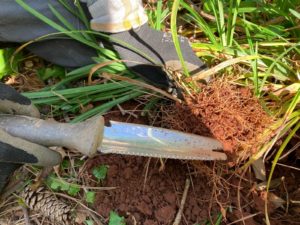
Where is `handle`? This screenshot has width=300, height=225. handle is located at coordinates (62, 127).